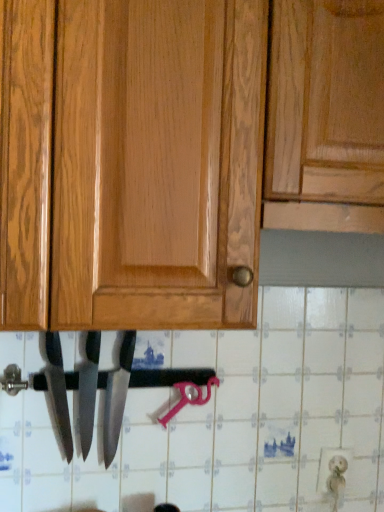
Question: Is polished silver knife at center, positioned as the 3th knife in left-to-right order, oriented away from polished silver knife at center, which is the second knife in left-to-right order?

Choices:
 (A) yes
 (B) no

Answer: (B)

Question: From a real-world perspective, is polished silver knife at center, positioned as the 3th knife in left-to-right order, over polished silver knife at center, which is the second knife in left-to-right order?

Choices:
 (A) yes
 (B) no

Answer: (B)

Question: Is polished silver knife at center, the first knife positioned from the right, wider than polished silver knife at center, which is counted as the 2th knife, starting from the right?

Choices:
 (A) no
 (B) yes

Answer: (B)

Question: Is polished silver knife at center, the first knife positioned from the right, directly adjacent to polished silver knife at center, which is counted as the 2th knife, starting from the right?

Choices:
 (A) yes
 (B) no

Answer: (A)

Question: Is polished silver knife at center, positioned as the 3th knife in left-to-right order, aimed at polished silver knife at center, which is counted as the 2th knife, starting from the right?

Choices:
 (A) yes
 (B) no

Answer: (B)

Question: Based on their positions, is polished silver knife at lower center, acting as the third knife starting from the right, located to the left or right of polished silver knife at center, positioned as the 3th knife in left-to-right order?

Choices:
 (A) left
 (B) right

Answer: (A)

Question: In the image, is polished silver knife at lower center, acting as the third knife starting from the right, positioned in front of or behind polished silver knife at center, the first knife positioned from the right?

Choices:
 (A) front
 (B) behind

Answer: (A)

Question: From the image's perspective, is polished silver knife at lower center, acting as the third knife starting from the right, above or below polished silver knife at center, the first knife positioned from the right?

Choices:
 (A) below
 (B) above

Answer: (B)

Question: From their relative heights in the image, would you say polished silver knife at lower center, acting as the third knife starting from the right, is taller or shorter than polished silver knife at center, positioned as the 3th knife in left-to-right order?

Choices:
 (A) short
 (B) tall

Answer: (A)

Question: In the image, is polished silver knife at center, positioned as the 3th knife in left-to-right order, positioned in front of or behind polished silver knife at lower center, acting as the 1th knife starting from the left?

Choices:
 (A) behind
 (B) front

Answer: (A)

Question: From the image's perspective, is polished silver knife at center, positioned as the 3th knife in left-to-right order, positioned above or below polished silver knife at lower center, acting as the 1th knife starting from the left?

Choices:
 (A) above
 (B) below

Answer: (B)

Question: From a real-world perspective, relative to polished silver knife at lower center, acting as the 1th knife starting from the left, is polished silver knife at center, the first knife positioned from the right, vertically above or below?

Choices:
 (A) below
 (B) above

Answer: (A)

Question: Is polished silver knife at center, positioned as the 3th knife in left-to-right order, spatially inside polished silver knife at lower center, acting as the third knife starting from the right, or outside of it?

Choices:
 (A) inside
 (B) outside

Answer: (B)

Question: Is polished silver knife at center, which is counted as the 2th knife, starting from the right, situated inside polished silver knife at center, the first knife positioned from the right, or outside?

Choices:
 (A) outside
 (B) inside

Answer: (A)

Question: From the image's perspective, relative to polished silver knife at center, positioned as the 3th knife in left-to-right order, is polished silver knife at center, which is the second knife in left-to-right order, above or below?

Choices:
 (A) below
 (B) above

Answer: (B)